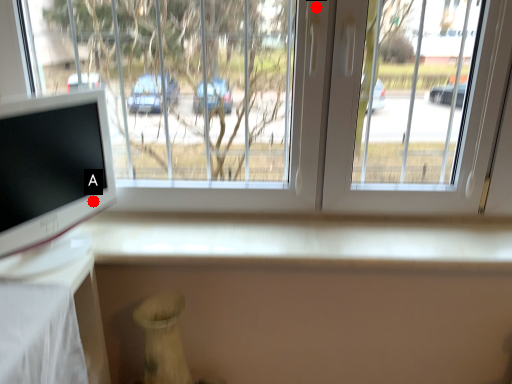
Question: Two points are circled on the image, labeled by A and B beside each circle. Which point is farther to the camera?

Choices:
 (A) A is further
 (B) B is further

Answer: (A)